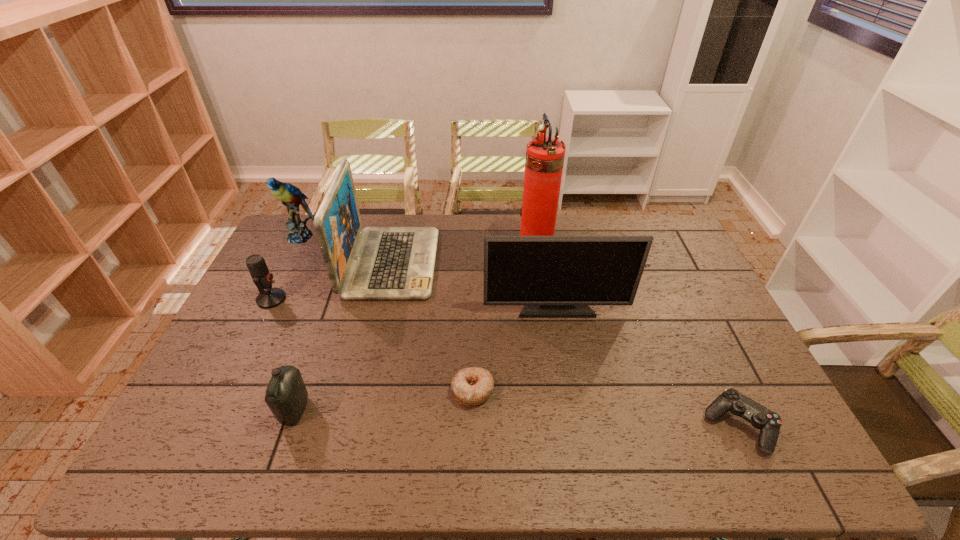
Find the location of a particular element. free spot between the shortest object and the monitor is located at coordinates (514, 349).

You are a GUI agent. You are given a task and a screenshot of the screen. Output one action in this format:
    pyautogui.click(x=<x>, y=<y>)
    Task: Click on the object that stands as the third closest to the parrot
    The image size is (960, 540).
    Given the screenshot: What is the action you would take?
    pyautogui.click(x=286, y=395)

The width and height of the screenshot is (960, 540). I want to click on object that is the closest to the bottle, so click(271, 297).

I want to click on free space in the image that satisfies the following two spatial constraints: 1. at the discharge end of the fire extinguisher; 2. on the back side of the second shortest object, so click(563, 426).

Find the location of a particular element. Image resolution: width=960 pixels, height=540 pixels. vacant area that satisfies the following two spatial constraints: 1. on the screen side of the monitor; 2. on the left side of the second shortest object is located at coordinates (577, 426).

You are a GUI agent. You are given a task and a screenshot of the screen. Output one action in this format:
    pyautogui.click(x=<x>, y=<y>)
    Task: Click on the vacant space that satisfies the following two spatial constraints: 1. on the back side of the control; 2. on the screen of the laptop computer
    The height and width of the screenshot is (540, 960).
    Given the screenshot: What is the action you would take?
    pyautogui.click(x=662, y=263)

Find the location of `free space that satisfies the following two spatial constraints: 1. on the side of the microphone with the red ring; 2. on the left side of the bottle`. free space that satisfies the following two spatial constraints: 1. on the side of the microphone with the red ring; 2. on the left side of the bottle is located at coordinates (216, 410).

Where is `vacant region that satisfies the following two spatial constraints: 1. at the discharge end of the tallest object; 2. on the front side of the bottle`? Image resolution: width=960 pixels, height=540 pixels. vacant region that satisfies the following two spatial constraints: 1. at the discharge end of the tallest object; 2. on the front side of the bottle is located at coordinates point(560,410).